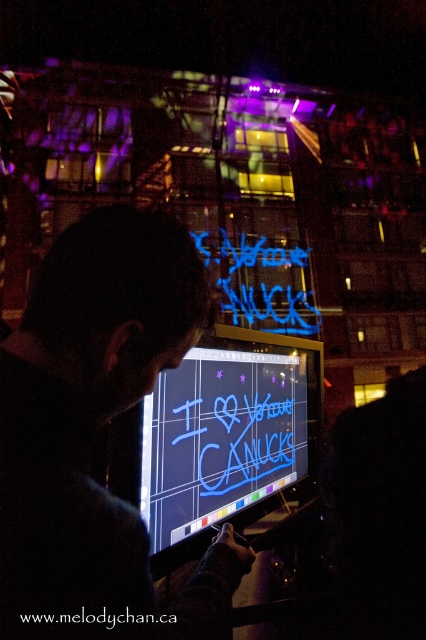
Is black fabric at center to the right of neon blue text at center from the viewer's perspective?

In fact, black fabric at center is to the left of neon blue text at center.

Between black fabric at center and neon blue text at center, which one has more height?

neon blue text at center

Consider the image. Measure the distance between point [65,385] and camera.

55.17 centimeters

Find the location of a particular element. The height and width of the screenshot is (640, 426). black fabric at center is located at coordinates (95, 429).